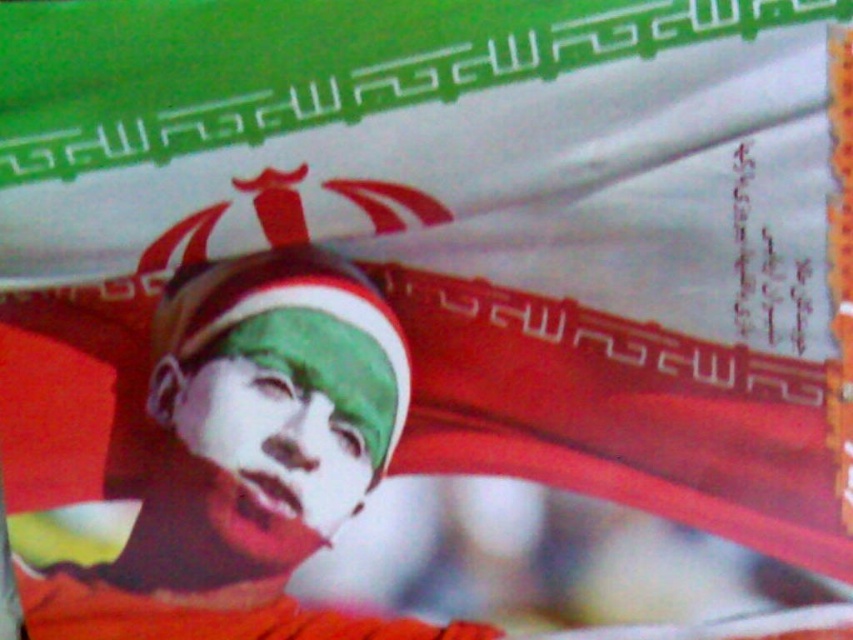
Which is below, matte green cap at center or green matte face at center?

Positioned lower is matte green cap at center.

Looking at this image, does matte green cap at center appear on the right side of green matte face at center?

No, matte green cap at center is not to the right of green matte face at center.

I want to click on matte green cap at center, so point(242,458).

Image resolution: width=853 pixels, height=640 pixels. Identify the location of matte green cap at center. (242, 458).